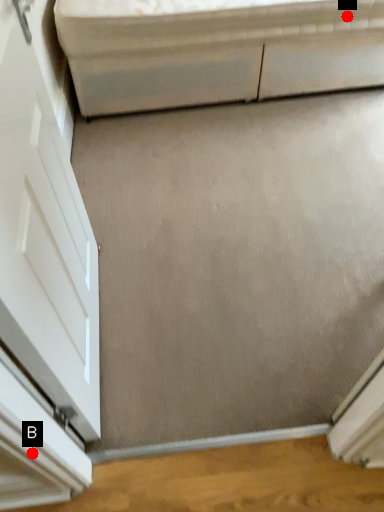
Question: Two points are circled on the image, labeled by A and B beside each circle. Which point appears closest to the camera in this image?

Choices:
 (A) A is closer
 (B) B is closer

Answer: (B)